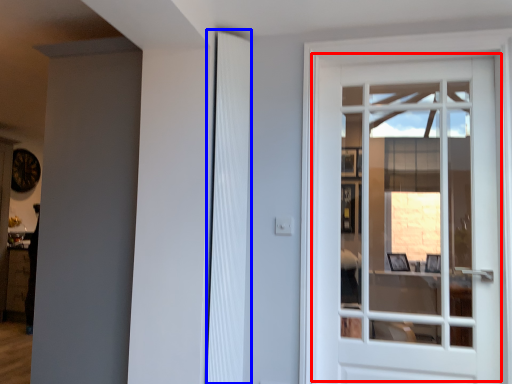
Question: Which object is further to the camera taking this photo, door (highlighted by a red box) or shutter (highlighted by a blue box)?

Choices:
 (A) door
 (B) shutter

Answer: (B)